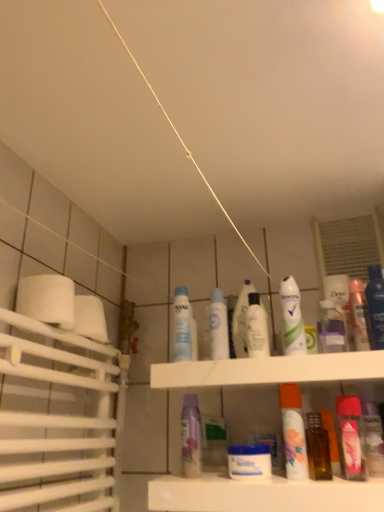
Question: Considering the relative sizes of white glossy mouthwash at center, which appears as the fifth mouthwash when viewed from the right, and translucent orange spray can at center, acting as the 6th mouthwash starting from the left, in the image provided, is white glossy mouthwash at center, which appears as the fifth mouthwash when viewed from the right, shorter than translucent orange spray can at center, acting as the 6th mouthwash starting from the left,?

Choices:
 (A) yes
 (B) no

Answer: (A)

Question: Can you confirm if white glossy mouthwash at center, the fifth mouthwash in the left-to-right sequence, is taller than translucent orange spray can at center, placed as the fourth mouthwash when sorted from right to left?

Choices:
 (A) no
 (B) yes

Answer: (A)

Question: Does white glossy mouthwash at center, which appears as the fifth mouthwash when viewed from the right, have a greater width compared to translucent orange spray can at center, placed as the fourth mouthwash when sorted from right to left?

Choices:
 (A) yes
 (B) no

Answer: (A)

Question: Is white glossy mouthwash at center, the fifth mouthwash in the left-to-right sequence, not near translucent orange spray can at center, placed as the fourth mouthwash when sorted from right to left?

Choices:
 (A) yes
 (B) no

Answer: (B)

Question: Is translucent orange spray can at center, acting as the 6th mouthwash starting from the left, completely or partially inside white glossy mouthwash at center, which appears as the fifth mouthwash when viewed from the right?

Choices:
 (A) no
 (B) yes

Answer: (A)

Question: Does white glossy mouthwash at center, which appears as the fifth mouthwash when viewed from the right, lie behind translucent orange spray can at center, acting as the 6th mouthwash starting from the left?

Choices:
 (A) yes
 (B) no

Answer: (A)

Question: Does green matte mouthwash at upper center, which is the 7th mouthwash in left-to-right order, appear on the right side of white plastic shelf at center?

Choices:
 (A) yes
 (B) no

Answer: (A)

Question: Considering the relative sizes of green matte mouthwash at upper center, the 3th mouthwash viewed from the right, and white plastic shelf at center in the image provided, is green matte mouthwash at upper center, the 3th mouthwash viewed from the right, bigger than white plastic shelf at center?

Choices:
 (A) yes
 (B) no

Answer: (B)

Question: Is green matte mouthwash at upper center, the 3th mouthwash viewed from the right, smaller than white plastic shelf at center?

Choices:
 (A) yes
 (B) no

Answer: (A)

Question: Is white plastic shelf at center at the back of green matte mouthwash at upper center, which is the 7th mouthwash in left-to-right order?

Choices:
 (A) yes
 (B) no

Answer: (B)

Question: From the image's perspective, is green matte mouthwash at upper center, the 3th mouthwash viewed from the right, above white plastic shelf at center?

Choices:
 (A) yes
 (B) no

Answer: (A)

Question: Is green matte mouthwash at upper center, which is the 7th mouthwash in left-to-right order, positioned far away from white plastic shelf at center?

Choices:
 (A) no
 (B) yes

Answer: (A)

Question: From the image's perspective, is white glossy mouthwash at center, which appears as the fifth mouthwash when viewed from the right, beneath transparent plastic mouthwash at center, the first mouthwash viewed from the left?

Choices:
 (A) no
 (B) yes

Answer: (B)